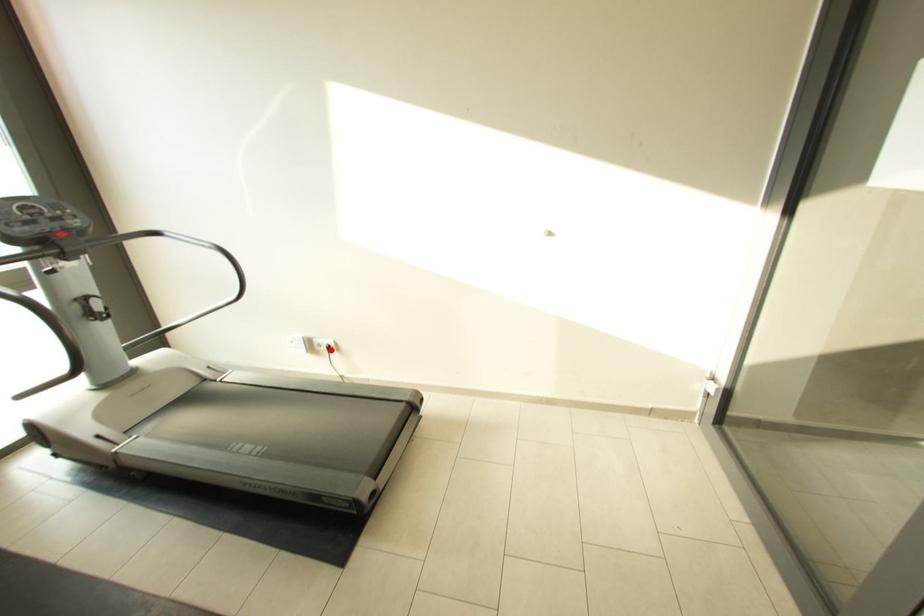
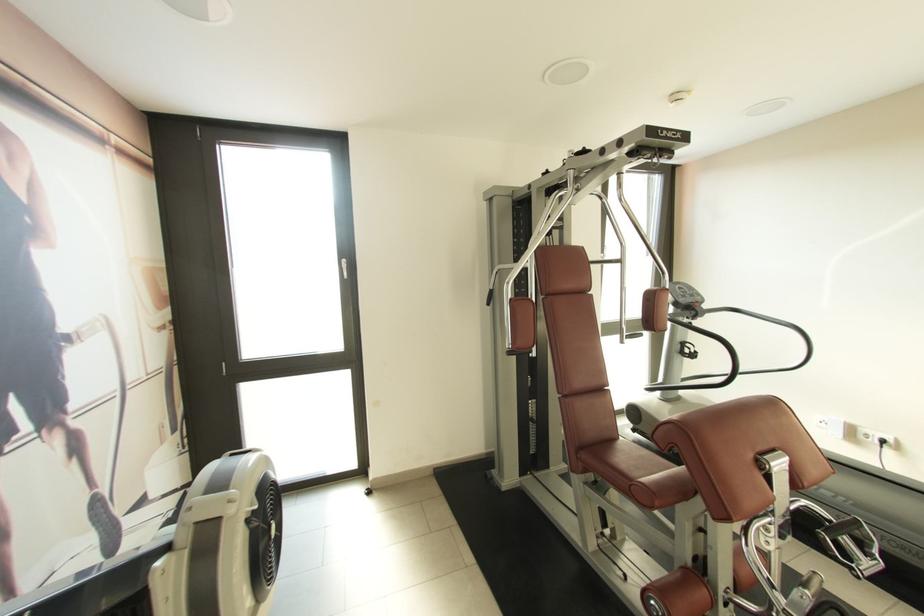
Question: I am providing you with two images of the same scene from different viewpoints. Image1 has a red point marked. In image2, the corresponding 3D location appears at what relative position? Reply with the corresponding letter.

Choices:
 (A) Closer
 (B) Farther

Answer: (A)